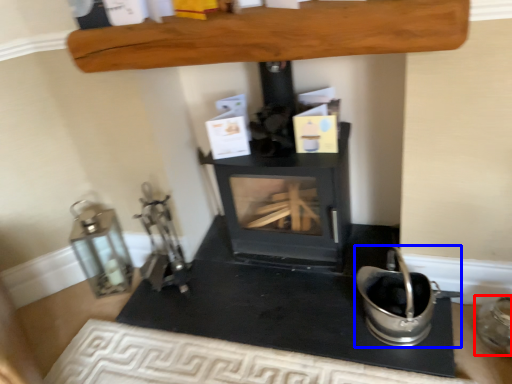
Question: Which object is further to the camera taking this photo, appliance (highlighted by a red box) or appliance (highlighted by a blue box)?

Choices:
 (A) appliance
 (B) appliance

Answer: (A)